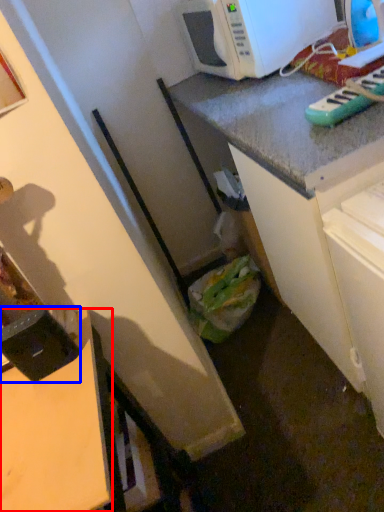
Question: Which point is further to the camera, desk (highlighted by a red box) or appliance (highlighted by a blue box)?

Choices:
 (A) desk
 (B) appliance

Answer: (B)